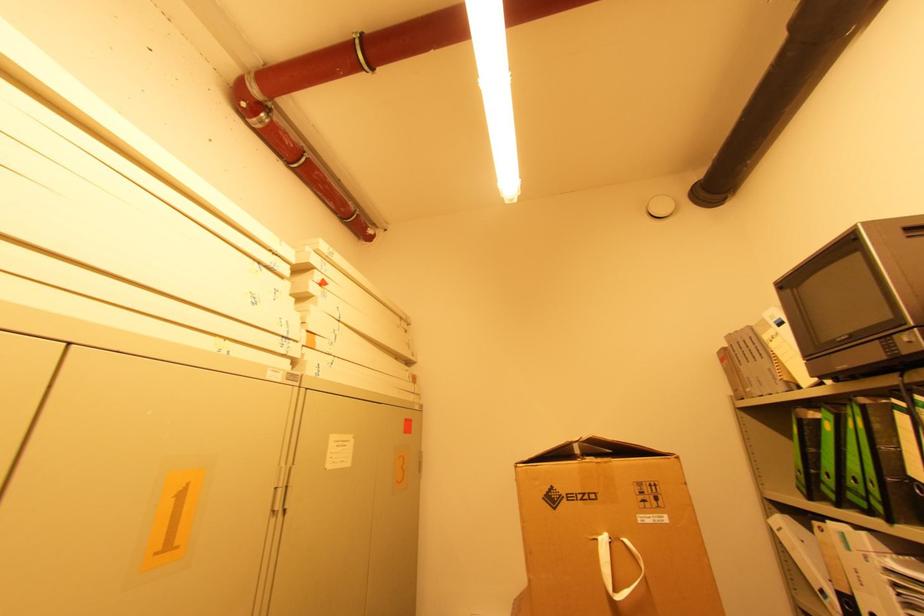
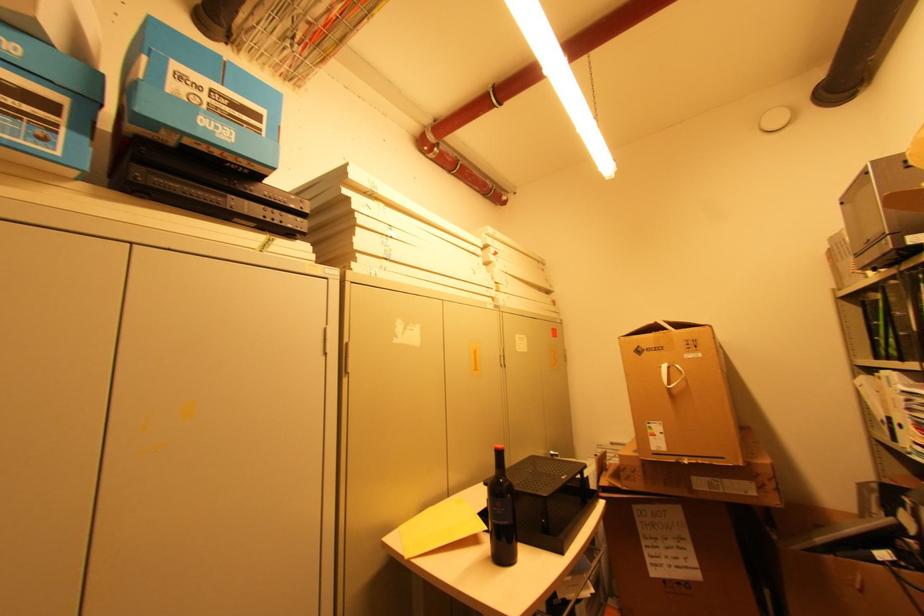
Question: What movement of the cameraman would produce the second image?

Choices:
 (A) Left
 (B) Right
 (C) Forward
 (D) Backward

Answer: (D)